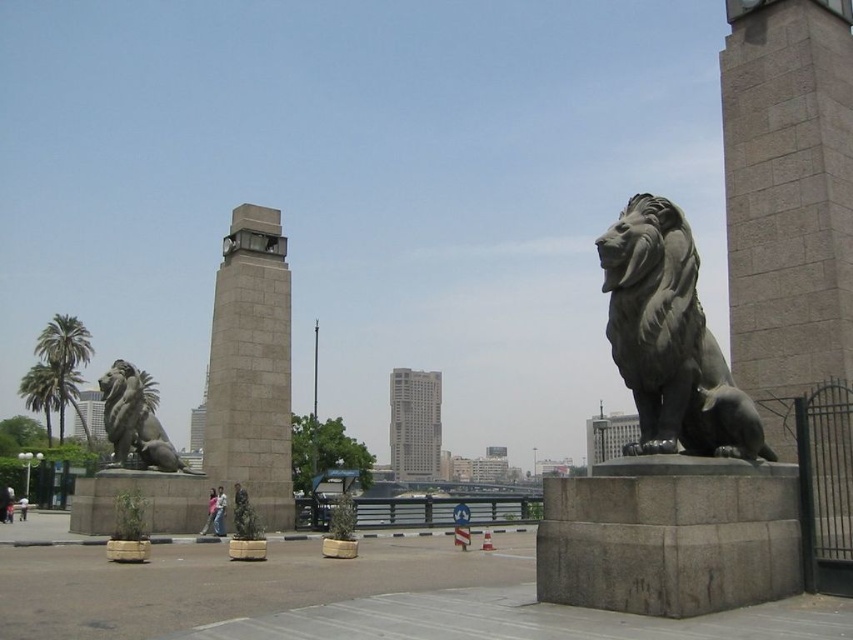
Question: Which point is farther to the camera?

Choices:
 (A) bronze lion at right
 (B) gray stone clock tower at center
 (C) smooth stone tower at center

Answer: (B)

Question: Is bronze lion at right positioned before bronze lion at left?

Choices:
 (A) yes
 (B) no

Answer: (A)

Question: Can you confirm if gray stone clock tower at center is positioned to the left of gray concrete skyscraper at center?

Choices:
 (A) yes
 (B) no

Answer: (A)

Question: Can you confirm if smooth stone tower at center is positioned to the right of bronze lion at left?

Choices:
 (A) yes
 (B) no

Answer: (A)

Question: Which point is farther to the camera?

Choices:
 (A) bronze lion at right
 (B) gray concrete skyscraper at center
 (C) gray stone clock tower at center
 (D) smooth stone tower at center

Answer: (B)

Question: Which point is closer to the camera taking this photo?

Choices:
 (A) (625, 301)
 (B) (421, 449)
 (C) (743, 182)

Answer: (A)